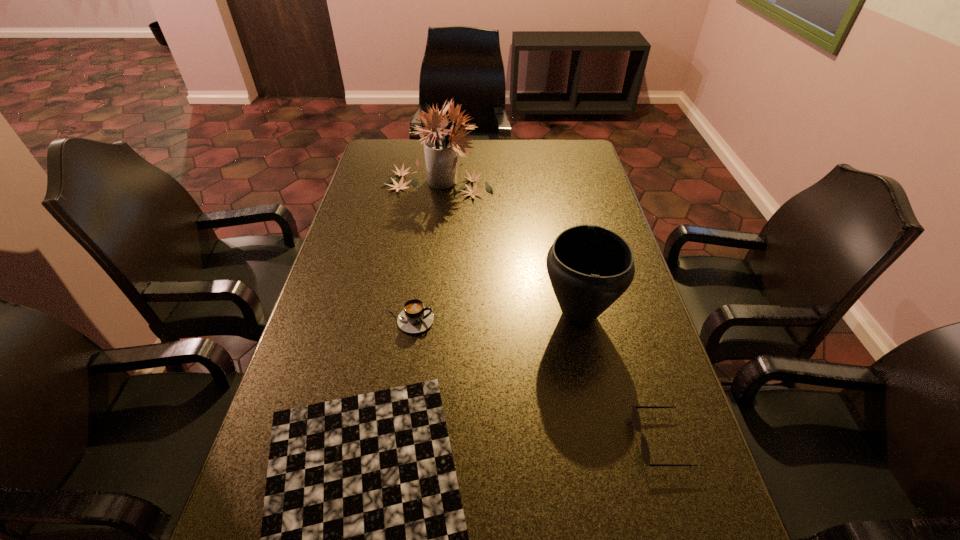
You are a GUI agent. You are given a task and a screenshot of the screen. Output one action in this format:
    pyautogui.click(x=<x>, y=<y>)
    Task: Click on the vacant area between the second tallest object and the bouquet
    The width and height of the screenshot is (960, 540).
    Given the screenshot: What is the action you would take?
    pyautogui.click(x=508, y=248)

You are a GUI agent. You are given a task and a screenshot of the screen. Output one action in this format:
    pyautogui.click(x=<x>, y=<y>)
    Task: Click on the free space between the farthest object and the urn
    This screenshot has height=540, width=960.
    Given the screenshot: What is the action you would take?
    pyautogui.click(x=508, y=248)

You are a GUI agent. You are given a task and a screenshot of the screen. Output one action in this format:
    pyautogui.click(x=<x>, y=<y>)
    Task: Click on the free area in between the cappuccino and the urn
    
    Given the screenshot: What is the action you would take?
    pyautogui.click(x=493, y=318)

This screenshot has height=540, width=960. I want to click on free spot between the bouquet and the sunglasses, so click(549, 312).

The width and height of the screenshot is (960, 540). I want to click on empty space between the urn and the sunglasses, so click(619, 377).

At what (x,y) coordinates should I click in order to perform the action: click on vacant area between the second tallest object and the cappuccino. Please return your answer as a coordinate pair (x, y). Image resolution: width=960 pixels, height=540 pixels. Looking at the image, I should click on (493, 318).

Image resolution: width=960 pixels, height=540 pixels. What are the coordinates of `free space between the fourth shortest object and the cappuccino` in the screenshot? It's located at (493, 318).

The width and height of the screenshot is (960, 540). In order to click on free space that is in between the cappuccino and the sunglasses in this screenshot , I will do `click(535, 381)`.

Select which object is the third closest to the checkerboard. Please provide its 2D coordinates. Your answer should be formatted as a tuple, i.e. [(x, y)], where the tuple contains the x and y coordinates of a point satisfying the conditions above.

[(636, 422)]

Where is `object that is the fourth nearest to the farthest object`? Image resolution: width=960 pixels, height=540 pixels. object that is the fourth nearest to the farthest object is located at coordinates (636, 422).